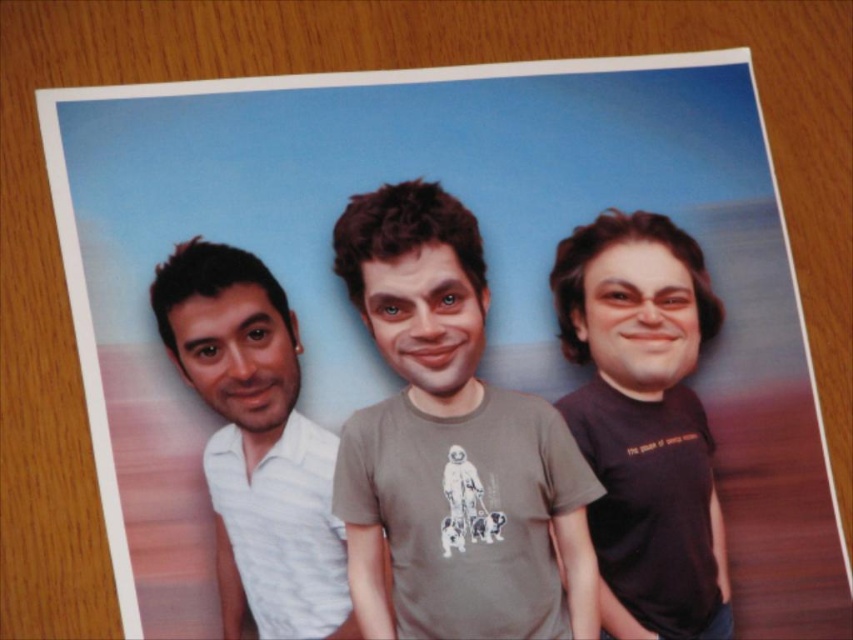
Is gray cotton t-shirt at center closer to the viewer compared to black matte t-shirt at right?

That is True.

Which is in front, point (381, 316) or point (576, 250)?

Positioned in front is point (381, 316).

Is point (579, 480) positioned in front of point (701, 433)?

That is True.

Locate an element on the screen. The height and width of the screenshot is (640, 853). gray cotton t-shirt at center is located at coordinates (451, 444).

How distant is black matte t-shirt at right from white textured shirt at left?

black matte t-shirt at right and white textured shirt at left are 11.86 inches apart.

Is black matte t-shirt at right thinner than white textured shirt at left?

Correct, black matte t-shirt at right's width is less than white textured shirt at left's.

Which is in front, point (694, 422) or point (289, 632)?

Point (289, 632) is in front.

I want to click on black matte t-shirt at right, so click(x=643, y=420).

Which is above, gray cotton t-shirt at center or white textured shirt at left?

gray cotton t-shirt at center is higher up.

Does gray cotton t-shirt at center appear on the right side of white textured shirt at left?

Indeed, gray cotton t-shirt at center is positioned on the right side of white textured shirt at left.

Identify the location of gray cotton t-shirt at center. 451,444.